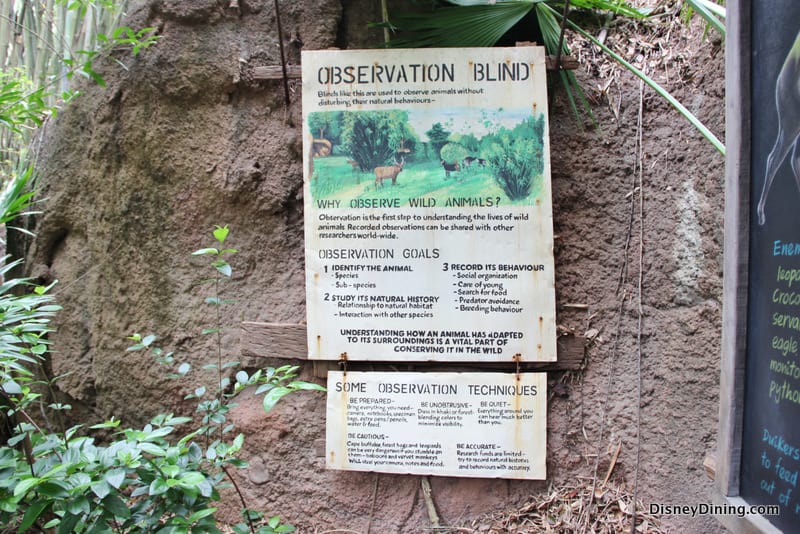
Find the location of a particular element. blackboard part of the chalkboard is located at coordinates (758, 348).